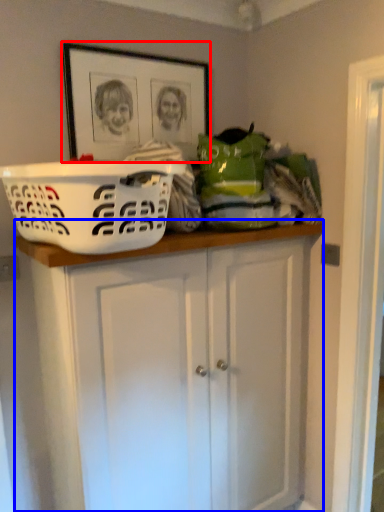
Question: Which object is further to the camera taking this photo, picture frame (highlighted by a red box) or cabinetry (highlighted by a blue box)?

Choices:
 (A) picture frame
 (B) cabinetry

Answer: (A)